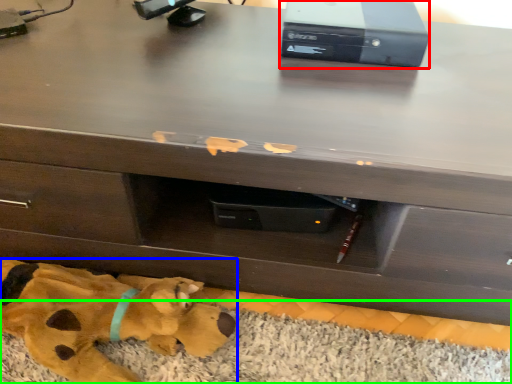
Question: Considering the real-world distances, which object is closest to computer (highlighted by a red box)? toy (highlighted by a blue box) or mat (highlighted by a green box).

Choices:
 (A) toy
 (B) mat

Answer: (B)